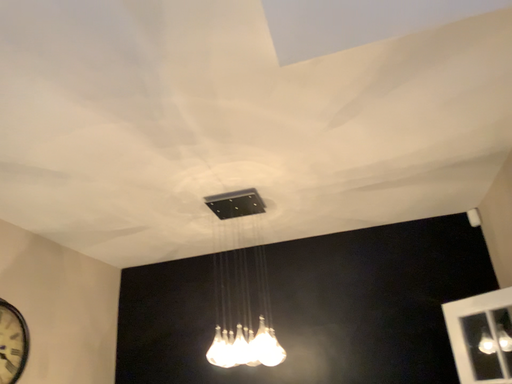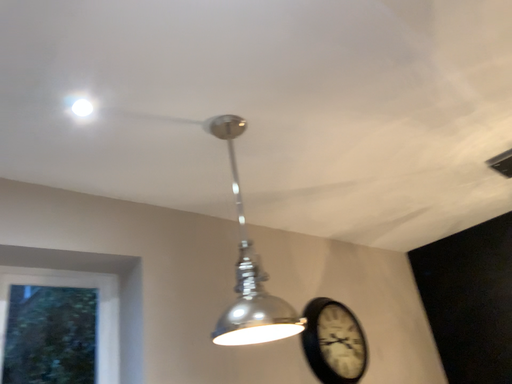
Question: Which way did the camera rotate in the video?

Choices:
 (A) rotated upward
 (B) rotated downward

Answer: (B)